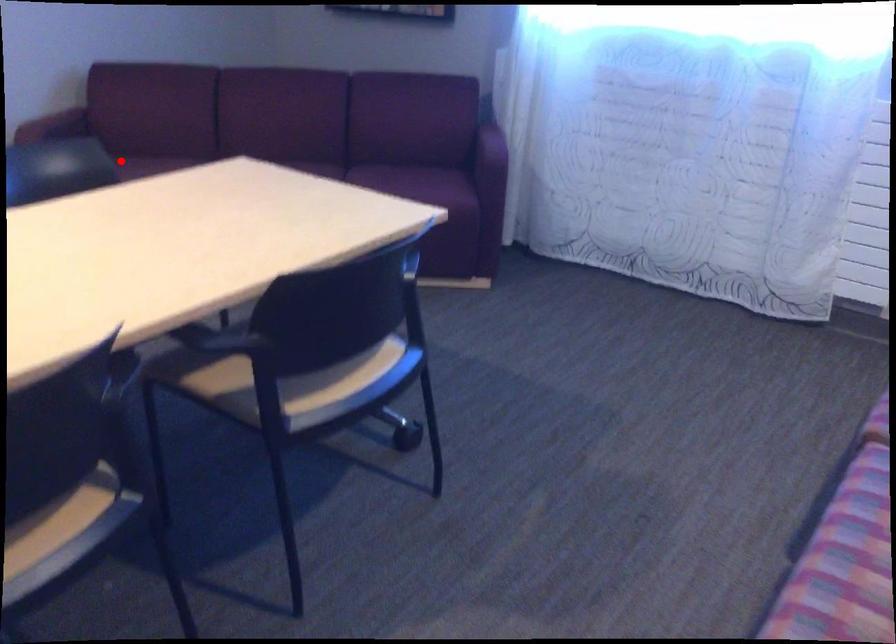
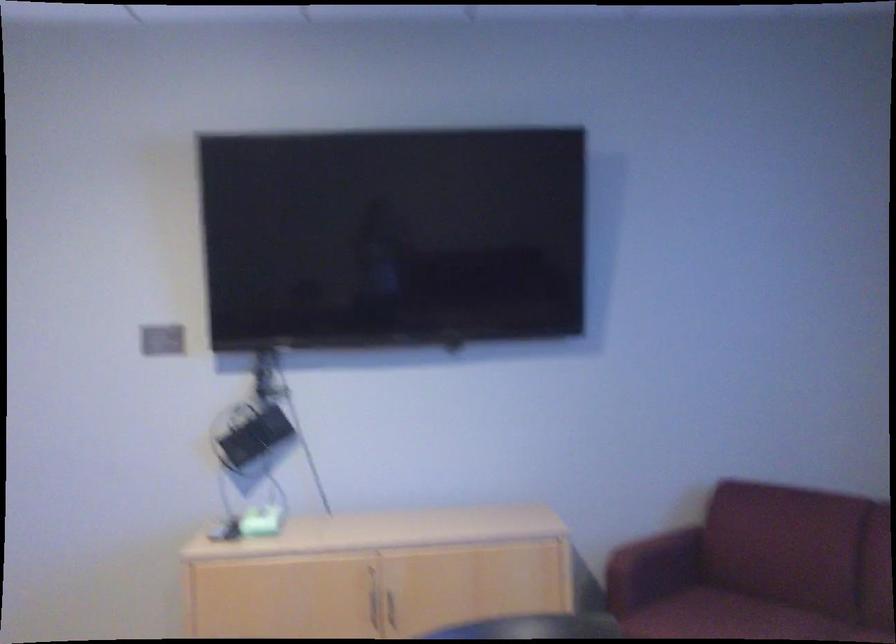
Where in the second image is the point corresponding to the highlighted location from the first image?

(722, 616)